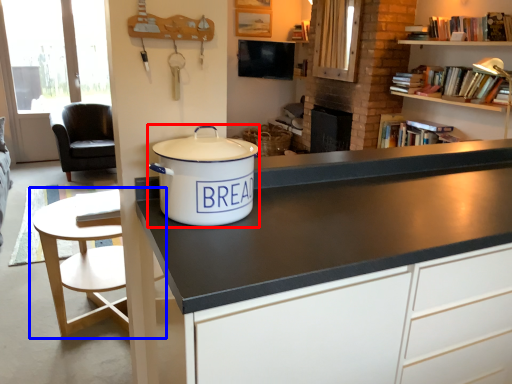
Question: Which point is closer to the camera, cooker (highlighted by a red box) or table (highlighted by a blue box)?

Choices:
 (A) cooker
 (B) table

Answer: (A)